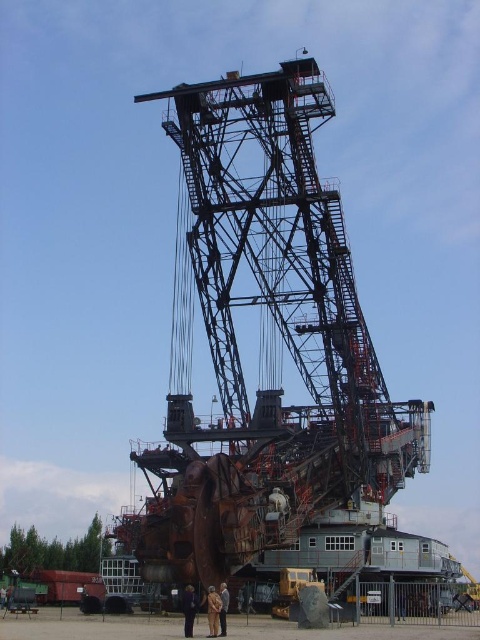
You are an observer standing in front of the industrial machinery and notice two items hanging on a hook at the center. Which item is positioned lower between the brown leather jacket at center and the dark blue fabric coat at center?

The brown leather jacket at center is positioned lower than the dark blue fabric coat at center, as it is located below it on the hook.

You are an observer standing in front of the industrial machinery. You notice a brown leather jacket at center and a dark blue fabric coat at center. Which one is taller?

The dark blue fabric coat at center is taller because the brown leather jacket at center is shorter than it.

You are standing in front of the industrial machinery and notice a brown leather jacket at center. Where exactly is the brown leather jacket positioned relative to the bucket wheel excavator?

The brown leather jacket at center is located at point (213, 611) relative to the bucket wheel excavator.